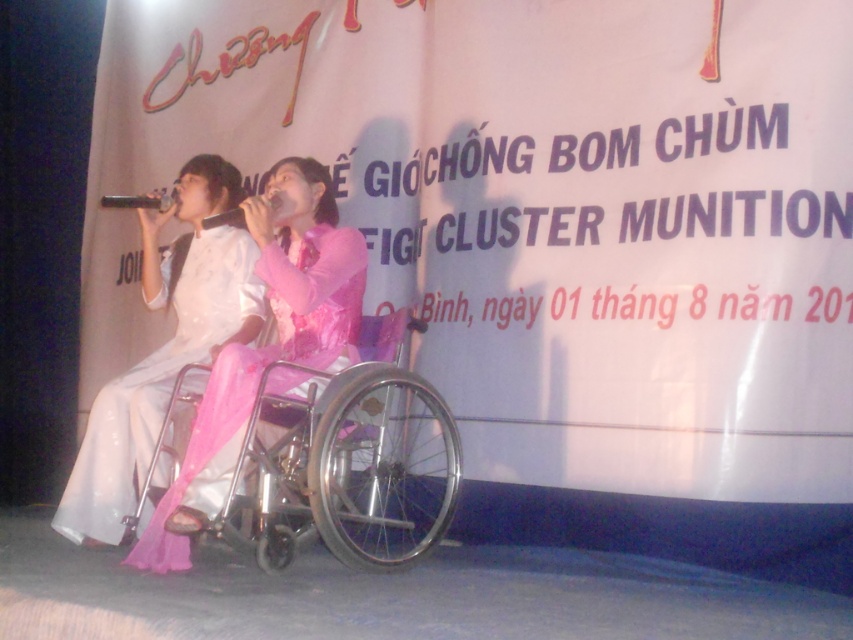
You are a stagehand preparing to move the silver metallic wheelchair at center and the pink satin dress at center to the left side of the stage. The stage is narrow, and you can only move one item at a time. If you want to place them side by side without overlapping, what is the minimum total width required for the stage area where they will be placed?

The minimum total width required for the stage area to place the silver metallic wheelchair at center and the pink satin dress at center side by side without overlapping is 12.83 inches, as that is the distance between them.

You are a stagehand preparing for a performance. You need to ensure that the silver metallic wheelchair at center is visible to the audience. Considering the pink satin dress at center is part of the performer, which object might block the view of the wheelchair and why?

The pink satin dress at center could block the view of the silver metallic wheelchair at center because the pink satin dress at center is taller than the wheelchair.

You are standing in front of the stage where the two performers are seated. You want to move closer to the point at coordinates point (161, 516). If your height is 5.5 feet, will you be able to see the banner behind them without any obstruction?

The point at coordinates point (161, 516) is 9.25 feet away from the viewer. Since the banner is behind the performers, if you move to that point, you will be 9.25 feet away from the stage. Depending on the height of the performers and the banner, it might be visible. However, since the performers are seated and the banner is likely mounted high, you should be able to see it as long as there are no physical obstructions like poles or curtains between you and the stage.